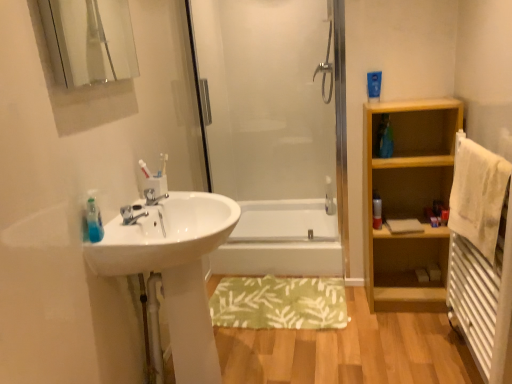
Question: In terms of width, does white soft towel at right look wider or thinner when compared to white plastic bottle at right?

Choices:
 (A) thin
 (B) wide

Answer: (B)

Question: From a real-world perspective, is white soft towel at right positioned above or below white plastic bottle at right?

Choices:
 (A) above
 (B) below

Answer: (A)

Question: Based on their relative distances, which object is nearer to the white glossy sink at left?

Choices:
 (A) light wood shelf at right
 (B) white plastic bottle at right
 (C) green fabric bath mat at center
 (D) transparent glass shower door at center
 (E) white textured radiator at right

Answer: (C)

Question: Based on their relative distances, which object is farther from the green fabric bath mat at center?

Choices:
 (A) white glossy bathtub at center
 (B) clear glass mirror at upper left
 (C) transparent glass shower door at center
 (D) white plastic bottle at right
 (E) white glossy sink at left

Answer: (B)